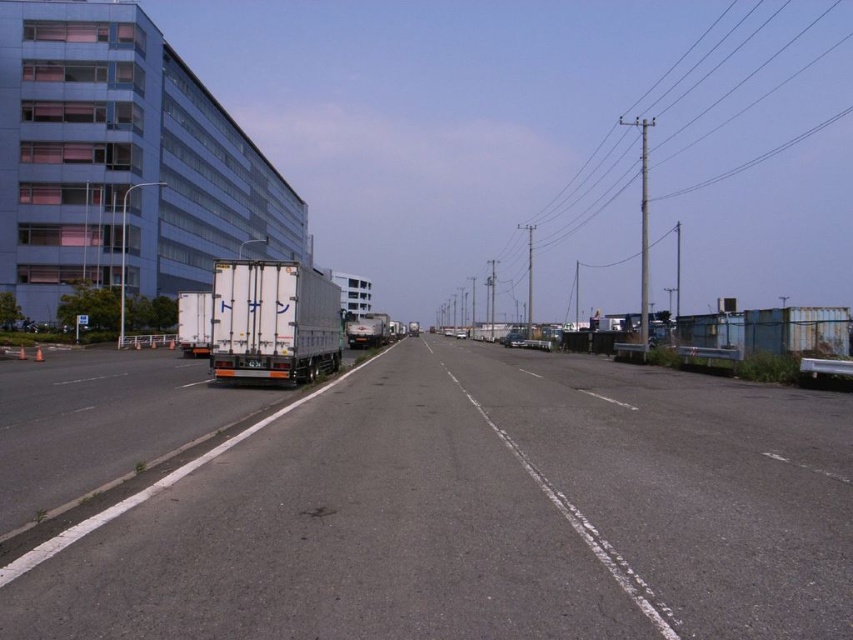
Does black asphalt highway at center have a greater width compared to white matte trailer truck at center?

Yes, black asphalt highway at center is wider than white matte trailer truck at center.

Who is more forward, (766, 496) or (263, 365)?

Point (766, 496) is more forward.

Describe the element at coordinates (479, 515) in the screenshot. This screenshot has width=853, height=640. I see `black asphalt highway at center` at that location.

Identify the location of black asphalt highway at center. The image size is (853, 640). 479,515.